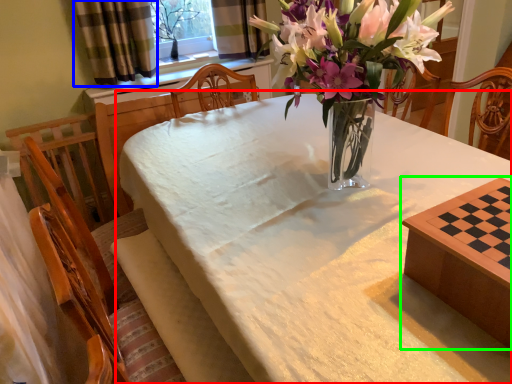
Question: Which object is the closest to the table (highlighted by a red box)? Choose among these: curtain (highlighted by a blue box) or table (highlighted by a green box).

Choices:
 (A) curtain
 (B) table

Answer: (B)